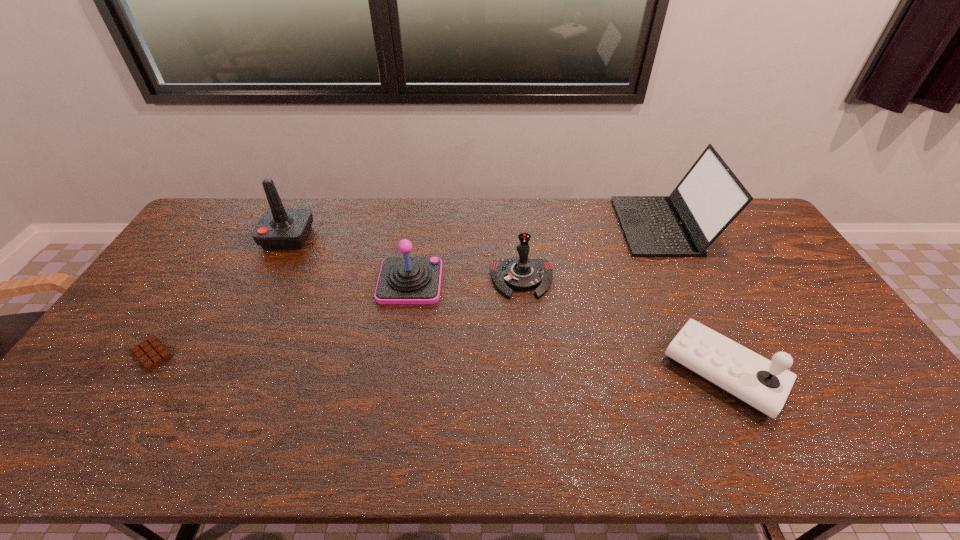
Where is `blank space located 0.210m on the surface of the laptop`? Image resolution: width=960 pixels, height=540 pixels. blank space located 0.210m on the surface of the laptop is located at coordinates (562, 226).

Identify the location of free space located 0.240m on the left of the tallest joystick. The width and height of the screenshot is (960, 540). (196, 238).

Locate an element on the screen. free spot located 0.330m forward from the base of the third joystick from right to left is located at coordinates (546, 281).

You are a GUI agent. You are given a task and a screenshot of the screen. Output one action in this format:
    pyautogui.click(x=<x>, y=<y>)
    Task: Click on the free space located on the handle side of the fourth object from left to right
    
    Given the screenshot: What is the action you would take?
    pyautogui.click(x=527, y=330)

Where is `vacant space located on the left of the nearest joystick`? The width and height of the screenshot is (960, 540). vacant space located on the left of the nearest joystick is located at coordinates (542, 372).

Locate an element on the screen. free location located on the right of the leftmost object is located at coordinates (260, 354).

Find the location of `laptop that is at the far edge`. laptop that is at the far edge is located at coordinates (709, 197).

This screenshot has width=960, height=540. I want to click on joystick that is at the far edge, so click(279, 228).

Locate an element on the screen. This screenshot has height=540, width=960. object situated at the near edge is located at coordinates (761, 385).

At what (x,y) coordinates should I click in order to perform the action: click on object that is at the left edge. Please return your answer as a coordinate pair (x, y). Looking at the image, I should click on (151, 352).